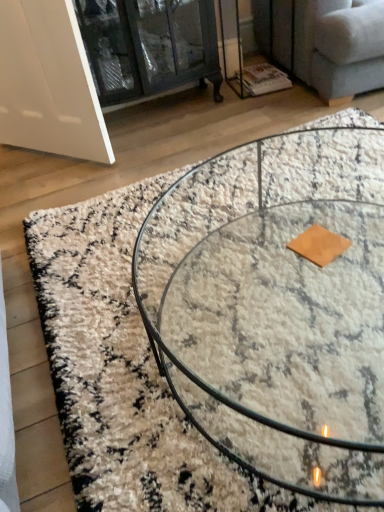
Question: From a real-world perspective, is clear glass coffee table at center on top of light gray fabric couch at upper right?

Choices:
 (A) yes
 (B) no

Answer: (B)

Question: Is clear glass coffee table at center at the left side of light gray fabric couch at upper right?

Choices:
 (A) no
 (B) yes

Answer: (B)

Question: Is clear glass coffee table at center positioned with its back to light gray fabric couch at upper right?

Choices:
 (A) no
 (B) yes

Answer: (A)

Question: Does clear glass coffee table at center come behind light gray fabric couch at upper right?

Choices:
 (A) no
 (B) yes

Answer: (A)

Question: Does clear glass coffee table at center appear on the right side of light gray fabric couch at upper right?

Choices:
 (A) yes
 (B) no

Answer: (B)

Question: Is clear glass coffee table at center not within light gray fabric couch at upper right?

Choices:
 (A) yes
 (B) no

Answer: (A)

Question: Can you confirm if clear glass cabinet at upper left is shorter than clear glass coffee table at center?

Choices:
 (A) no
 (B) yes

Answer: (A)

Question: Can clear glass coffee table at center be found inside clear glass cabinet at upper left?

Choices:
 (A) no
 (B) yes

Answer: (A)

Question: Considering the relative sizes of clear glass cabinet at upper left and clear glass coffee table at center in the image provided, is clear glass cabinet at upper left thinner than clear glass coffee table at center?

Choices:
 (A) no
 (B) yes

Answer: (B)

Question: Could you tell me if clear glass cabinet at upper left is facing clear glass coffee table at center?

Choices:
 (A) no
 (B) yes

Answer: (B)

Question: Does clear glass cabinet at upper left come in front of clear glass coffee table at center?

Choices:
 (A) yes
 (B) no

Answer: (B)

Question: Is clear glass coffee table at center at the back of clear glass cabinet at upper left?

Choices:
 (A) no
 (B) yes

Answer: (A)

Question: Is light gray fabric couch at upper right at the left side of clear glass coffee table at center?

Choices:
 (A) yes
 (B) no

Answer: (B)